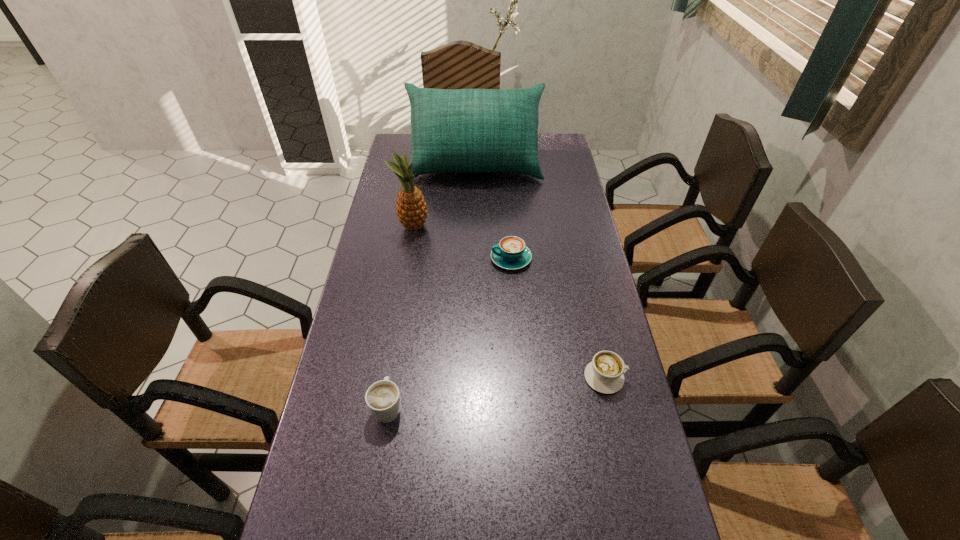
Locate an element on the screen. This screenshot has width=960, height=540. cushion is located at coordinates (465, 130).

The height and width of the screenshot is (540, 960). I want to click on pineapple, so click(411, 207).

Identify the location of the tallest cappuccino. The image size is (960, 540). (383, 399).

Where is `the third tallest object`? The image size is (960, 540). the third tallest object is located at coordinates (383, 399).

Where is `the rightmost object`? The height and width of the screenshot is (540, 960). the rightmost object is located at coordinates (605, 373).

The image size is (960, 540). Identify the location of the farthest cappuccino. (511, 253).

Locate an element on the screen. the second cappuccino from left to right is located at coordinates (511, 253).

The width and height of the screenshot is (960, 540). Find the location of `vacant space located 0.340m on the front-facing side of the farthest object`. vacant space located 0.340m on the front-facing side of the farthest object is located at coordinates (474, 248).

In order to click on vacant space located 0.270m on the back of the fourth nearest object in this screenshot , I will do `click(421, 173)`.

Identify the location of free location located 0.180m with the handle on the side of the leftmost cappuccino. (400, 329).